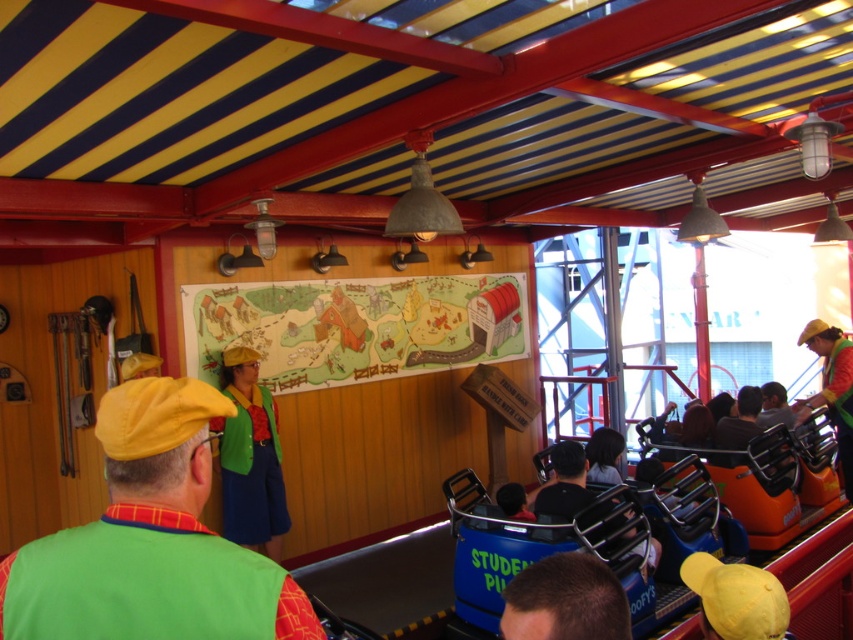
Question: Which point is closer to the camera taking this photo?

Choices:
 (A) (260, 522)
 (B) (567, 605)

Answer: (B)

Question: Considering the relative positions of matte green vest at center and dark brown hair at lower center in the image provided, where is matte green vest at center located with respect to dark brown hair at lower center?

Choices:
 (A) below
 (B) above

Answer: (A)

Question: Is the position of green fabric vest at center less distant than that of dark brown hair at lower center?

Choices:
 (A) no
 (B) yes

Answer: (A)

Question: Can you confirm if green fabric vest at center is wider than dark brown hair at lower center?

Choices:
 (A) no
 (B) yes

Answer: (B)

Question: Which of these objects is positioned farthest from the green fabric vest at center?

Choices:
 (A) dark brown hair at lower center
 (B) matte green vest at center

Answer: (B)

Question: Which of the following is the farthest from the observer?

Choices:
 (A) (119, 580)
 (B) (276, 477)
 (C) (561, 612)

Answer: (B)